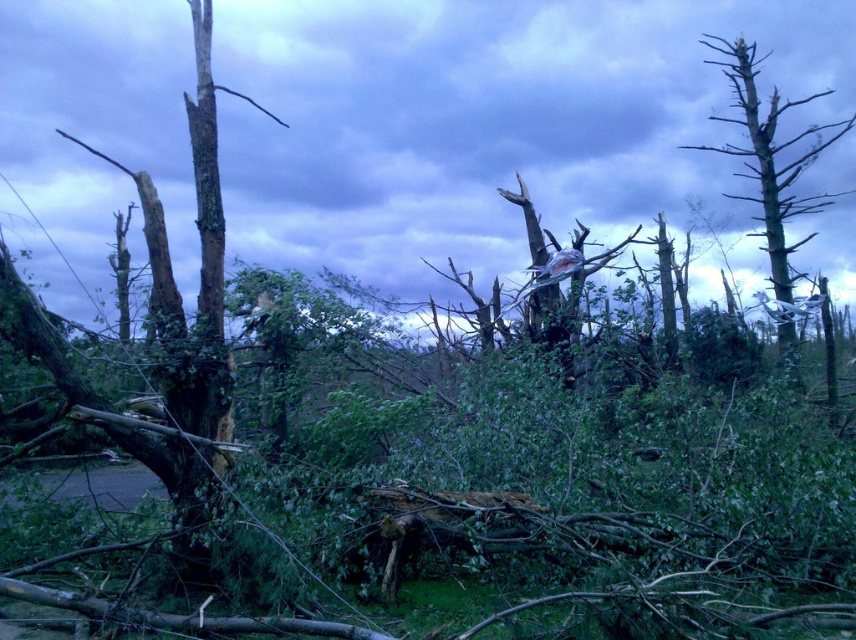
You are a disaster response worker assessing the scene. You see dead wood debris at center and a bare wood tree at right. Which object is closer to you from your current viewpoint?

The dead wood debris at center is positioned over bare wood tree at right, meaning it is closer to you.

You are a disaster relief worker assessing the area. You need to clear the path blocked by the dead wood debris at center and the bare wood tree at right. Which object should you prioritize removing first based on their sizes?

The dead wood debris at center is bigger than the bare wood tree at right, so you should prioritize removing the dead wood debris at center first because it is larger and might block the path more significantly.

You are standing at the point with coordinates point (773, 236) and want to move to the point with coordinates point (554, 36). Is there any obstruction between you and your destination?

The point (554, 36) is behind point (773, 236), so there is an obstruction between you and your destination.